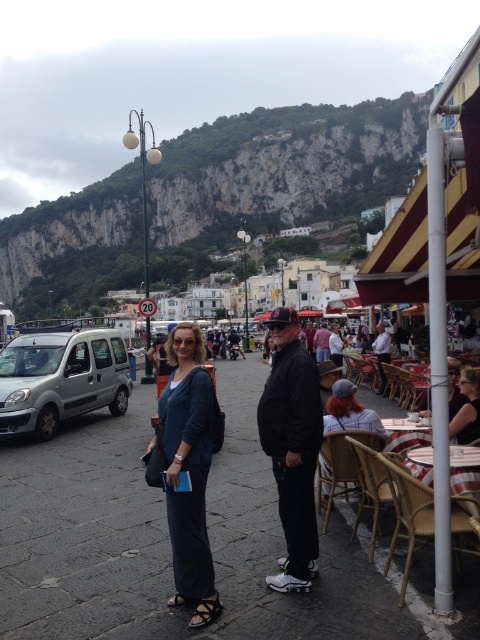
Which is more to the left, silver metallic van at left or leather sandal at lower center?

From the viewer's perspective, silver metallic van at left appears more on the left side.

In order to click on silver metallic van at left in this screenshot , I will do `click(60, 378)`.

You are a GUI agent. You are given a task and a screenshot of the screen. Output one action in this format:
    pyautogui.click(x=<x>, y=<y>)
    Task: Click on the silver metallic van at left
    The width and height of the screenshot is (480, 640).
    Given the screenshot: What is the action you would take?
    pyautogui.click(x=60, y=378)

Does point (205, 444) come farther from viewer compared to point (206, 611)?

Yes, point (205, 444) is farther from viewer.

Identify the location of dark blue fabric dress at center. The width and height of the screenshot is (480, 640). (188, 467).

What do you see at coordinates (188, 467) in the screenshot? The image size is (480, 640). I see `dark blue fabric dress at center` at bounding box center [188, 467].

Is dark blue fabric dress at center smaller than black leather sandal at lower center?

No.

Find the location of a particular element. The image size is (480, 640). dark blue fabric dress at center is located at coordinates (188, 467).